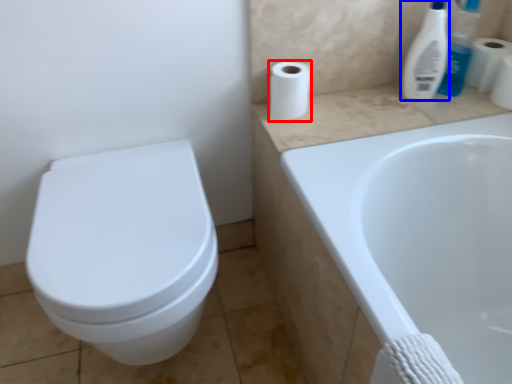
Question: Which object is further to the camera taking this photo, toilet paper (highlighted by a red box) or cleaning product (highlighted by a blue box)?

Choices:
 (A) toilet paper
 (B) cleaning product

Answer: (A)